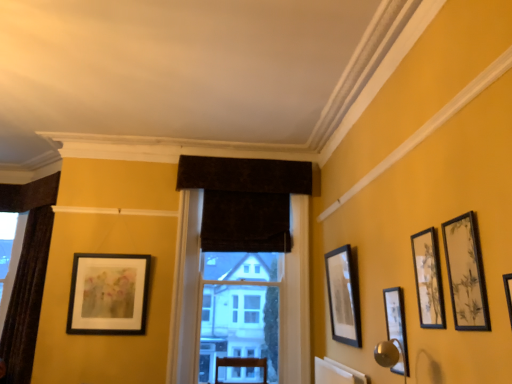
Question: Does matte black picture frame at upper right, placed as the first picture frame when sorted from right to left, have a larger size compared to matte black picture frame at right, which is the third picture frame from front to back?

Choices:
 (A) yes
 (B) no

Answer: (A)

Question: Does matte black picture frame at upper right, acting as the fifth picture frame starting from the left, come in front of matte black picture frame at right, which is the third picture frame from front to back?

Choices:
 (A) yes
 (B) no

Answer: (A)

Question: Is matte black picture frame at upper right, which is the 1th picture frame in front-to-back order, in contact with matte black picture frame at right, arranged as the third picture frame when viewed from the left?

Choices:
 (A) yes
 (B) no

Answer: (B)

Question: Is the depth of matte black picture frame at upper right, placed as the first picture frame when sorted from right to left, greater than that of matte black picture frame at right, arranged as the third picture frame when viewed from the left?

Choices:
 (A) yes
 (B) no

Answer: (B)

Question: Is matte black picture frame at upper right, acting as the fifth picture frame starting from the left, not close to matte black picture frame at right, placed as the third picture frame when sorted from right to left?

Choices:
 (A) no
 (B) yes

Answer: (A)

Question: In terms of size, does dark brown velvet curtain at left, arranged as the 2th window when viewed from the right, appear bigger or smaller than velvet dark brown curtain at center, the 2th window viewed from the left?

Choices:
 (A) small
 (B) big

Answer: (A)

Question: Is dark brown velvet curtain at left, arranged as the 2th window when viewed from the right, spatially inside velvet dark brown curtain at center, the 2th window viewed from the left, or outside of it?

Choices:
 (A) outside
 (B) inside

Answer: (A)

Question: Considering the positions of dark brown velvet curtain at left, the first window in the back-to-front sequence, and velvet dark brown curtain at center, the 2th window viewed from the left, in the image, is dark brown velvet curtain at left, the first window in the back-to-front sequence, wider or thinner than velvet dark brown curtain at center, the 2th window viewed from the left,?

Choices:
 (A) wide
 (B) thin

Answer: (B)

Question: In terms of height, does dark brown velvet curtain at left, placed as the 2th window when sorted from front to back, look taller or shorter compared to velvet dark brown curtain at center, which is the 1th window from front to back?

Choices:
 (A) tall
 (B) short

Answer: (B)

Question: Is velvet dark brown curtain at center, positioned as the second window in back-to-front order, taller or shorter than matte black picture frame at right, which is the third picture frame from front to back?

Choices:
 (A) tall
 (B) short

Answer: (A)

Question: Considering the positions of point (300, 228) and point (400, 306), is point (300, 228) closer or farther from the camera than point (400, 306)?

Choices:
 (A) farther
 (B) closer

Answer: (A)

Question: From a real-world perspective, is velvet dark brown curtain at center, the 2th window viewed from the left, above or below matte black picture frame at right, which is the third picture frame from front to back?

Choices:
 (A) below
 (B) above

Answer: (B)

Question: Relative to matte black picture frame at right, which is the third picture frame from front to back, is velvet dark brown curtain at center, positioned as the 1th window in right-to-left order, in front or behind?

Choices:
 (A) behind
 (B) front

Answer: (A)

Question: Is matte black picture frame at right, arranged as the third picture frame when viewed from the left, spatially inside dark velvet curtain at center, or outside of it?

Choices:
 (A) inside
 (B) outside

Answer: (B)

Question: Based on their sizes in the image, would you say matte black picture frame at right, arranged as the third picture frame when viewed from the left, is bigger or smaller than dark velvet curtain at center?

Choices:
 (A) small
 (B) big

Answer: (A)